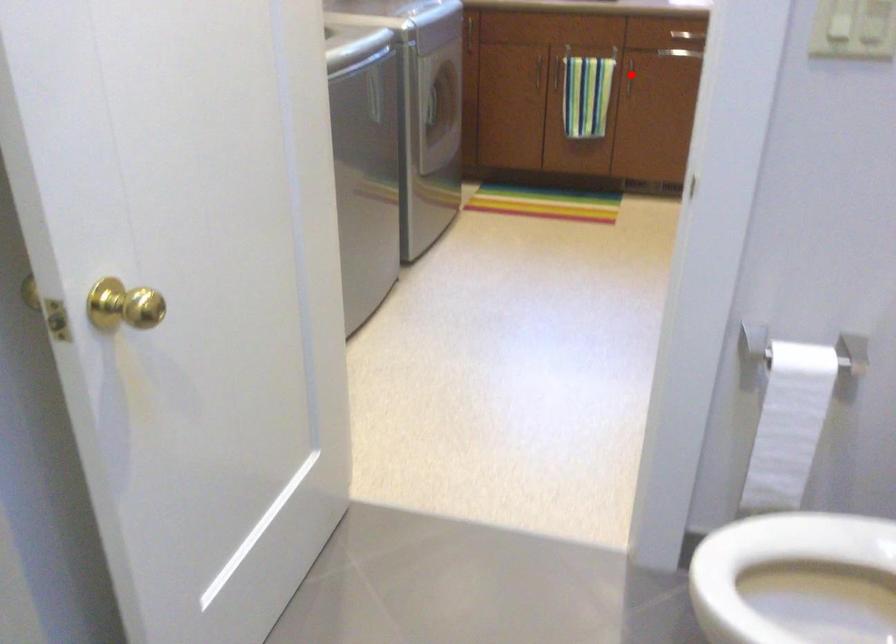
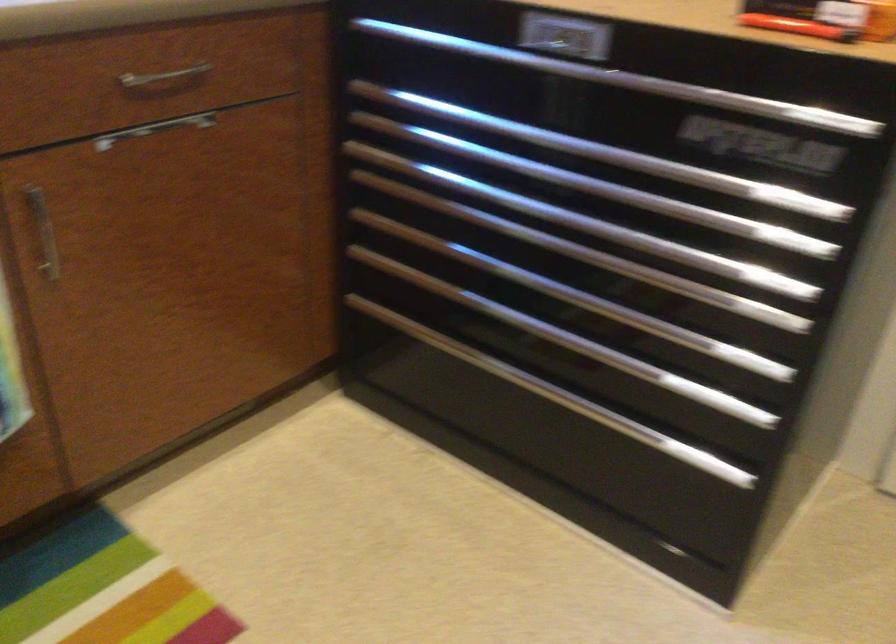
Where in the second image is the point corresponding to the highlighted location from the first image?

(42, 232)